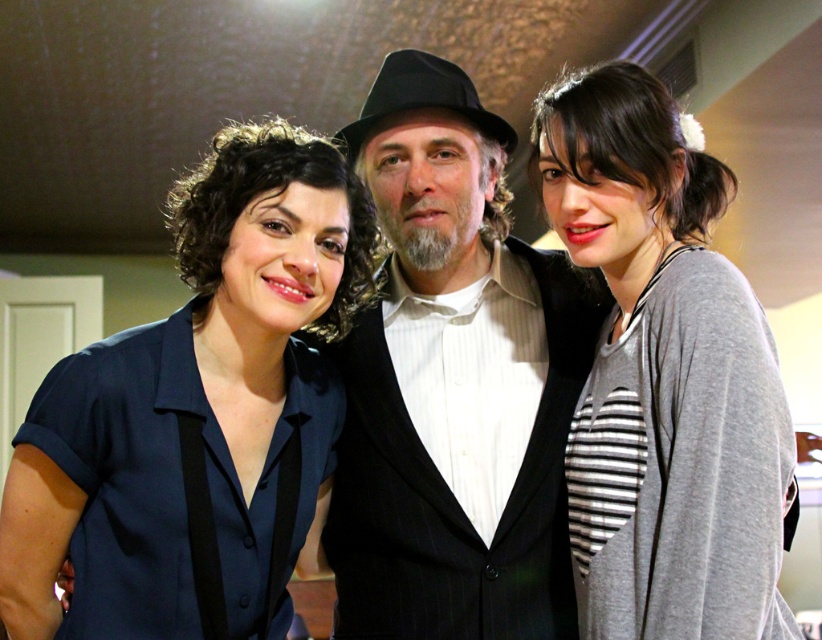
You are planning to take a photo of the black pinstripe suit at center and the matte blue shirt at left. Which of the two is wider in the image?

The black pinstripe suit at center is wider than the matte blue shirt at left.

You are standing in the dimly lit room and want to take a photo of the three people. The camera you have can only focus on objects within 3 feet. Is the point at coordinates point (105, 492) within the camera focus range?

The distance of point (105, 492) from camera is 3.47 feet, which is beyond the camera focus range of 3 feet. Therefore, the point is out of focus.